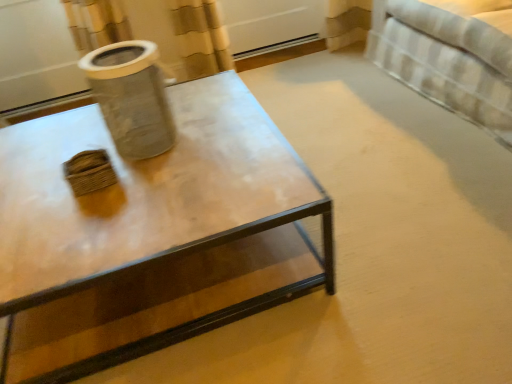
Question: Is matte glass coffee table at center shorter than white striped fabric bed at upper right?

Choices:
 (A) no
 (B) yes

Answer: (B)

Question: Does matte glass coffee table at center have a larger size compared to white striped fabric bed at upper right?

Choices:
 (A) no
 (B) yes

Answer: (A)

Question: Does matte glass coffee table at center appear on the right side of white striped fabric bed at upper right?

Choices:
 (A) yes
 (B) no

Answer: (B)

Question: Does matte glass coffee table at center come behind white striped fabric bed at upper right?

Choices:
 (A) no
 (B) yes

Answer: (A)

Question: Would you say matte glass coffee table at center is outside white striped fabric bed at upper right?

Choices:
 (A) yes
 (B) no

Answer: (A)

Question: Based on their sizes in the image, would you say white striped fabric bed at upper right is bigger or smaller than clear glass jar at upper left?

Choices:
 (A) small
 (B) big

Answer: (B)

Question: From a real-world perspective, relative to clear glass jar at upper left, is white striped fabric bed at upper right vertically above or below?

Choices:
 (A) below
 (B) above

Answer: (A)

Question: In the image, is white striped fabric bed at upper right positioned in front of or behind clear glass jar at upper left?

Choices:
 (A) behind
 (B) front

Answer: (A)

Question: Is point (486, 46) closer or farther from the camera than point (123, 46)?

Choices:
 (A) closer
 (B) farther

Answer: (B)

Question: Considering the positions of matte glass coffee table at center and clear glass jar at upper left in the image, is matte glass coffee table at center wider or thinner than clear glass jar at upper left?

Choices:
 (A) thin
 (B) wide

Answer: (B)

Question: From a real-world perspective, is matte glass coffee table at center positioned above or below clear glass jar at upper left?

Choices:
 (A) above
 (B) below

Answer: (B)

Question: Considering the positions of point (23, 352) and point (156, 112), is point (23, 352) closer or farther from the camera than point (156, 112)?

Choices:
 (A) closer
 (B) farther

Answer: (A)

Question: Choose the correct answer: Is matte glass coffee table at center inside clear glass jar at upper left or outside it?

Choices:
 (A) outside
 (B) inside

Answer: (A)

Question: In the image, is clear glass jar at upper left on the left side or the right side of white striped fabric bed at upper right?

Choices:
 (A) left
 (B) right

Answer: (A)

Question: In terms of width, does clear glass jar at upper left look wider or thinner when compared to white striped fabric bed at upper right?

Choices:
 (A) thin
 (B) wide

Answer: (A)